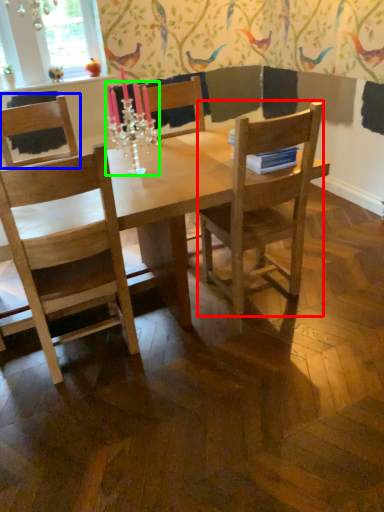
Question: Estimate the real-world distances between objects in this image. Which object is farther from chair (highlighted by a red box), chair (highlighted by a blue box) or candle holder (highlighted by a green box)?

Choices:
 (A) chair
 (B) candle holder

Answer: (A)